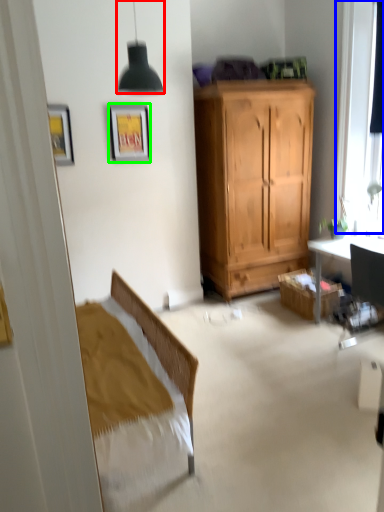
Question: Estimate the real-world distances between objects in this image. Which object is closer to lamp (highlighted by a red box), window (highlighted by a blue box) or picture frame (highlighted by a green box)?

Choices:
 (A) window
 (B) picture frame

Answer: (B)